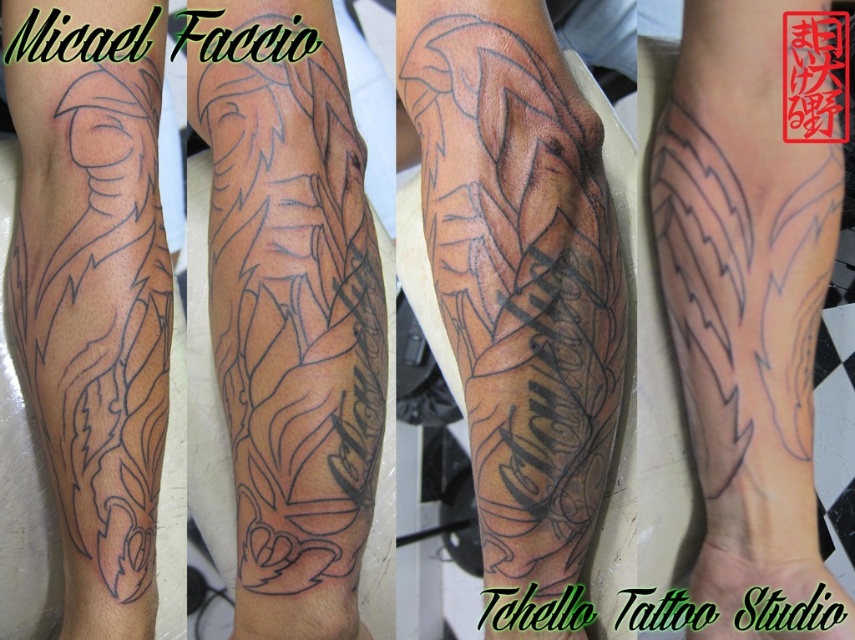
Is the point at coordinates (519, 273) located on the black ink tattoo at center?

Yes, the point at coordinates (519, 273) is located on the black ink tattoo at center.

Based on the photo, looking at the second left image of the tattoo process, which black ink tattoo is positioned to the left between the black ink tattoo at upper center and the black ink tattoo at center?

The black ink tattoo at upper center is positioned to the left of the black ink tattoo at center.